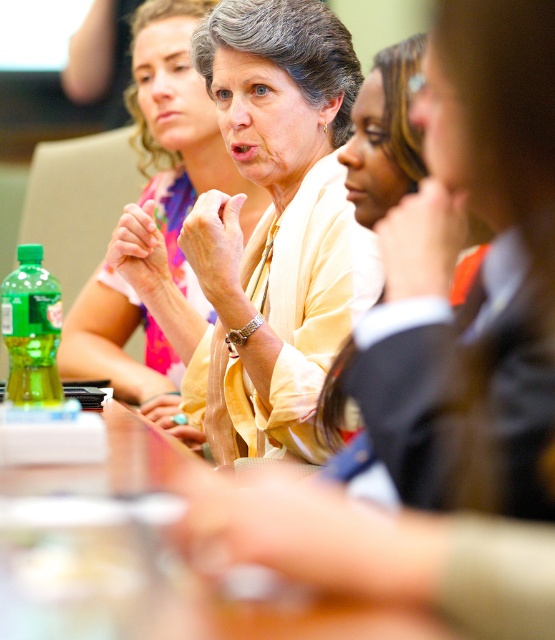
You are organizing a small event and need to choose between the yellow satin blouse at center and the clear plastic bottle at center for a display. Which item takes up more space?

The yellow satin blouse at center has a larger size compared to the clear plastic bottle at center, so it takes up more space.

You are a participant in the meeting and need to reach for the clear plastic bottle at center to take a sip. Is the bottle within easy reach from where the matte yellow blouse at center is sitting?

The clear plastic bottle at center is in front of the matte yellow blouse at center, so it should be easily reachable from that position.

You are organizing a meeting and need to place a new object on the conference table. The clear plastic bottle at center and the matte yellow blouse at center are already there. Which object can you place a small notebook next to without moving anything else?

The clear plastic bottle at center is smaller than the matte yellow blouse at center, so you can place the small notebook next to the clear plastic bottle at center since it has more space available.